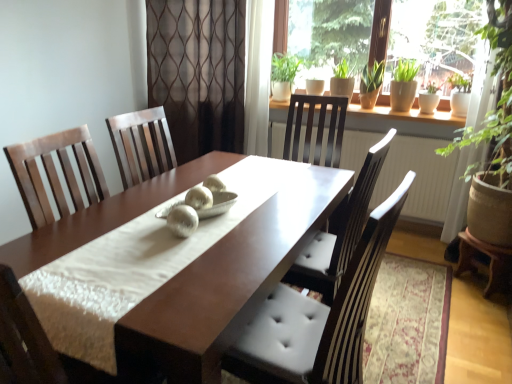
Question: In terms of height, does green leafy plant at right look taller or shorter compared to matte brown chair at center?

Choices:
 (A) short
 (B) tall

Answer: (B)

Question: Which is correct: green leafy plant at right is inside matte brown chair at center, or outside of it?

Choices:
 (A) inside
 (B) outside

Answer: (B)

Question: Which is farther from the matte brown chair at center?

Choices:
 (A) matte white table at lower right, which is the 1th table in right-to-left order
 (B) brown sheer curtain at center
 (C) white glossy radiator at upper center
 (D) shiny brown table at center, acting as the second table starting from the right
 (E) green leafy plant at right

Answer: (B)

Question: Which object is positioned closest to the brown sheer curtain at center?

Choices:
 (A) green leafy plant at right
 (B) matte white table at lower right, the 2th table from the left
 (C) shiny brown table at center, acting as the second table starting from the right
 (D) white glossy radiator at upper center
 (E) matte brown chair at center

Answer: (D)